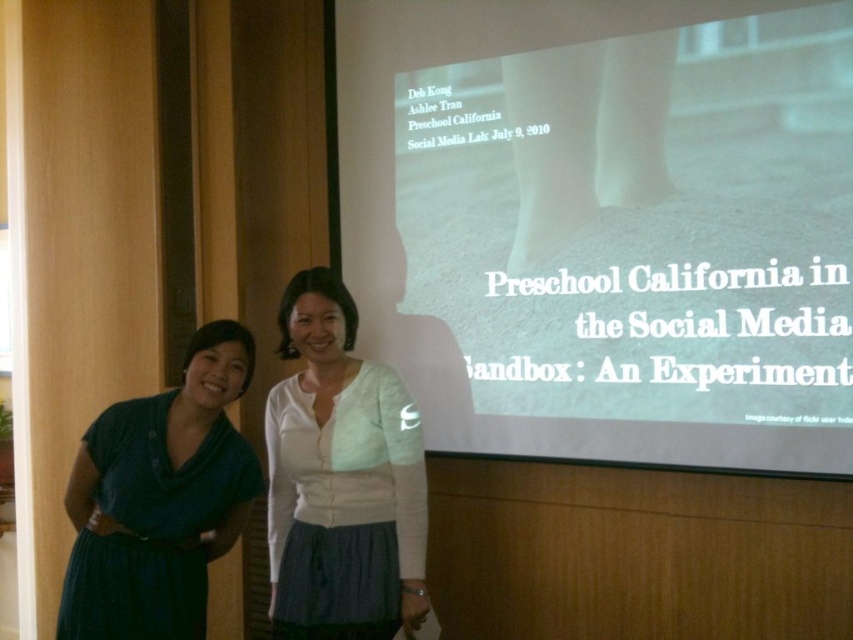
Does white matte projection screen at upper center appear on the left side of dark blue fabric dress at left?

No, white matte projection screen at upper center is not to the left of dark blue fabric dress at left.

What do you see at coordinates (606, 224) in the screenshot?
I see `white matte projection screen at upper center` at bounding box center [606, 224].

Does point (728, 406) come behind point (212, 324)?

Yes, point (728, 406) is farther from viewer.

Identify the location of white matte projection screen at upper center. (606, 224).

Which is behind, point (498, 35) or point (294, 380)?

The point (498, 35) is behind.

Describe the element at coordinates (606, 224) in the screenshot. I see `white matte projection screen at upper center` at that location.

Does point (438, 36) come in front of point (367, 518)?

No, it is not.

The width and height of the screenshot is (853, 640). Find the location of `white matte projection screen at upper center`. white matte projection screen at upper center is located at coordinates (606, 224).

Is point (282, 561) positioned after point (215, 323)?

Yes.

Can you confirm if white matte blouse at center is positioned to the left of dark blue fabric dress at left?

No, white matte blouse at center is not to the left of dark blue fabric dress at left.

This screenshot has height=640, width=853. Describe the element at coordinates (340, 480) in the screenshot. I see `white matte blouse at center` at that location.

At what (x,y) coordinates should I click in order to perform the action: click on white matte blouse at center. Please return your answer as a coordinate pair (x, y). This screenshot has width=853, height=640. Looking at the image, I should click on (340, 480).